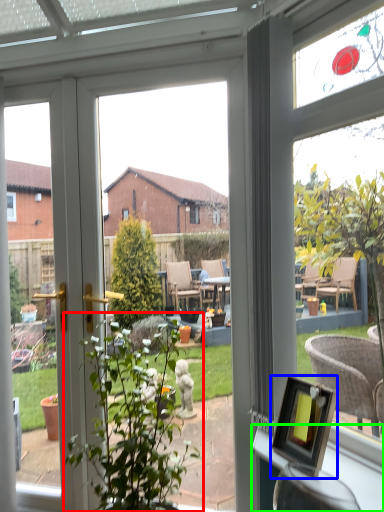
Question: Which object is positioned closest to houseplant (highlighted by a red box)? Select from picture frame (highlighted by a blue box) and window sill (highlighted by a green box).

Choices:
 (A) picture frame
 (B) window sill

Answer: (B)